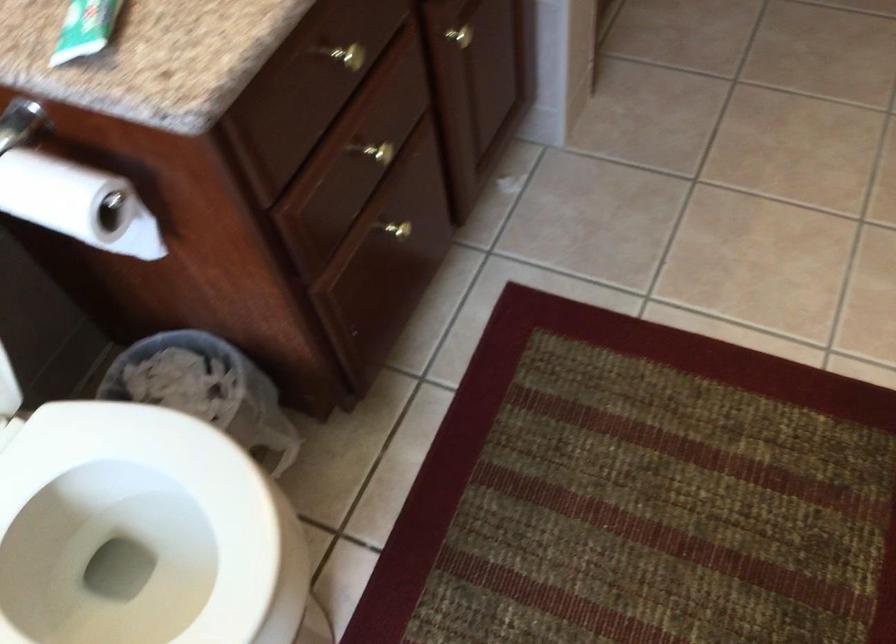
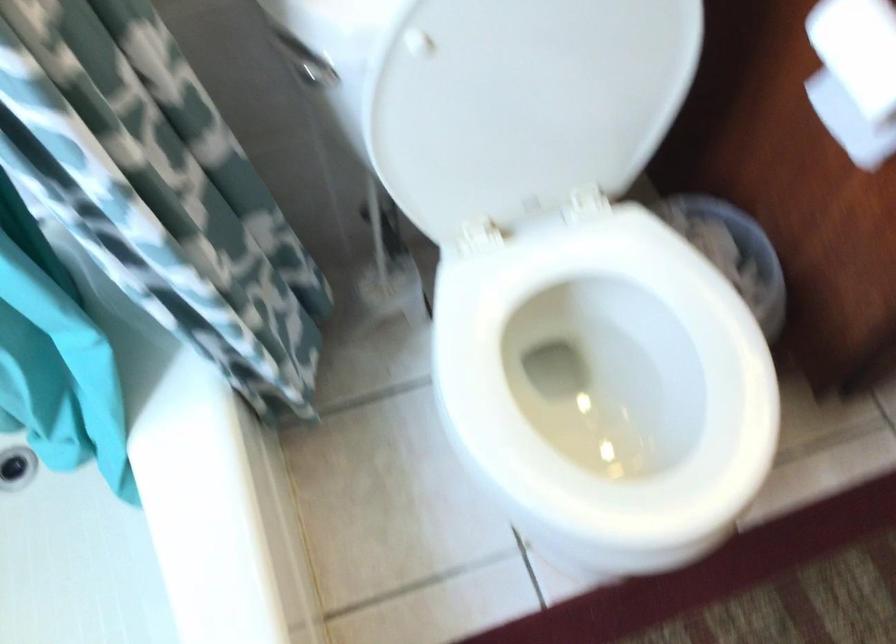
Question: The images are taken continuously from a first-person perspective. In which direction is your viewpoint rotating?

Choices:
 (A) Left
 (B) Right
 (C) Up
 (D) Down

Answer: (A)